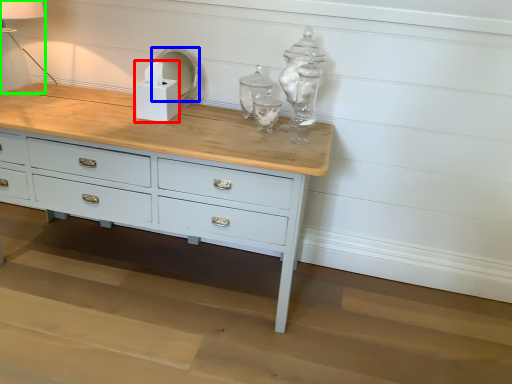
Question: Which object is the closest to the candle holder (highlighted by a red box)? Choose among these: mirror (highlighted by a blue box) or table lamp (highlighted by a green box).

Choices:
 (A) mirror
 (B) table lamp

Answer: (A)